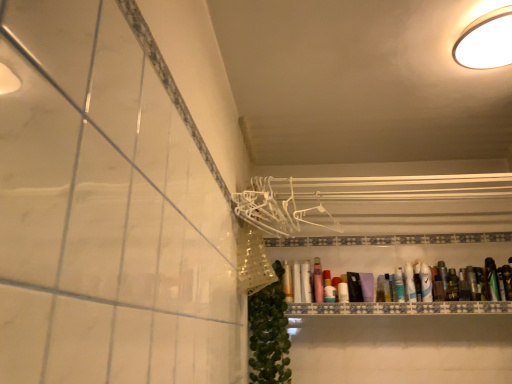
Question: Is white glossy light fixture at upper right bigger or smaller than matte plastic bottle at center, the 6th toiletry in the left-to-right sequence?

Choices:
 (A) big
 (B) small

Answer: (A)

Question: From the image's perspective, is white glossy light fixture at upper right positioned above or below matte plastic bottle at center, acting as the 6th toiletry starting from the right?

Choices:
 (A) above
 (B) below

Answer: (A)

Question: Estimate the real-world distances between objects in this image. Which object is closer to the green matte bottle at right, the second toiletry when ordered from right to left?

Choices:
 (A) green matte bottle at right, which appears as the 11th toiletry when viewed from the left
 (B) green leafy plant at lower center
 (C) translucent plastic container at center, placed as the 5th toiletry when sorted from left to right
 (D) white glossy light fixture at upper right
 (E) matte pink lotion at center, the 8th toiletry in the right-to-left sequence

Answer: (A)

Question: Based on their relative distances, which object is nearer to the matte plastic bottle at center, acting as the 6th toiletry starting from the right?

Choices:
 (A) white glossy bottle at upper right, which ranks as the eighth toiletry in left-to-right order
 (B) green leafy plant at lower center
 (C) gold metallic tube at upper center, placed as the 11th toiletry when sorted from right to left
 (D) clear plastic tube at center, the second toiletry when ordered from left to right
 (E) matte pink lotion at center, which is the 4th toiletry from left to right

Answer: (E)